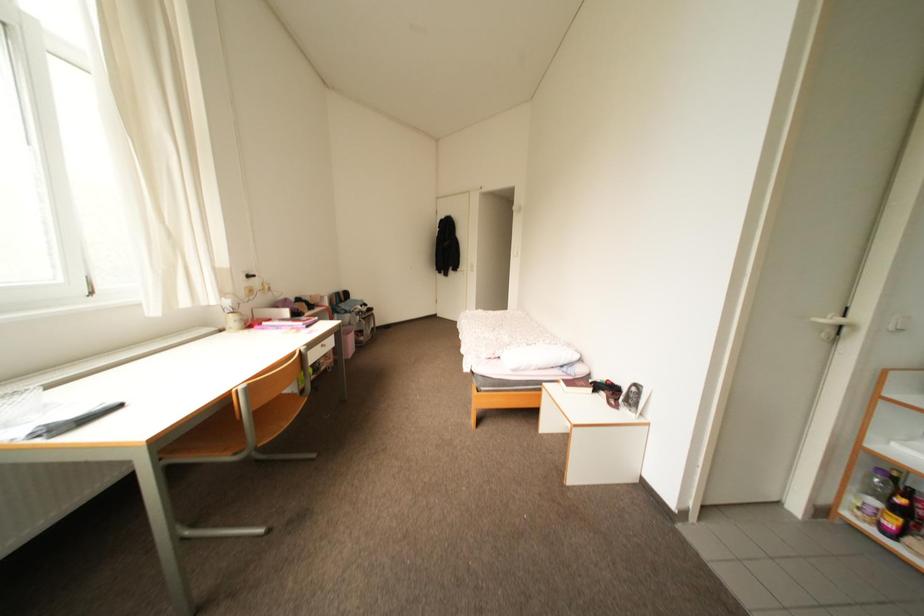
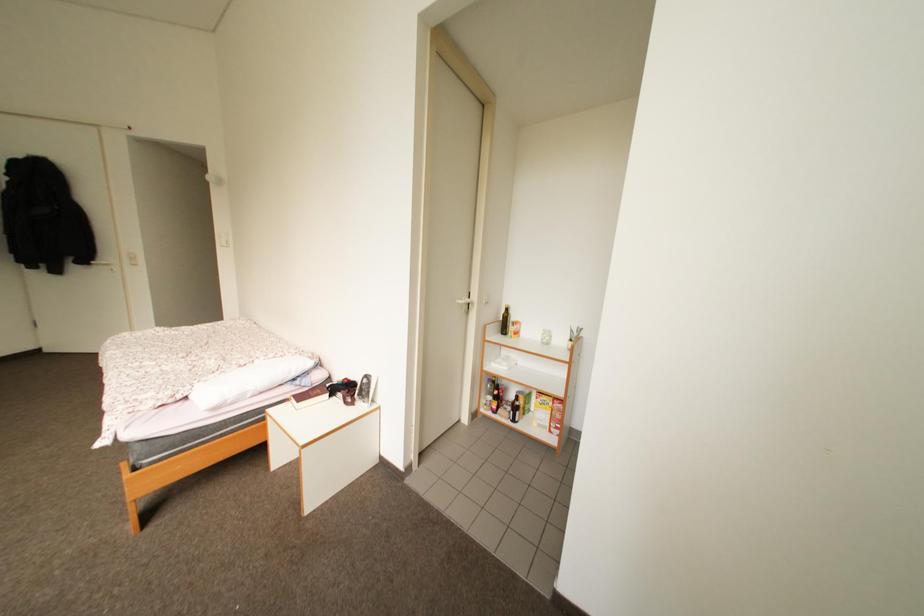
Question: Based on the continuous images, in which direction is the camera rotating? Reply with the corresponding letter.

Choices:
 (A) Left
 (B) Right
 (C) Up
 (D) Down

Answer: (B)